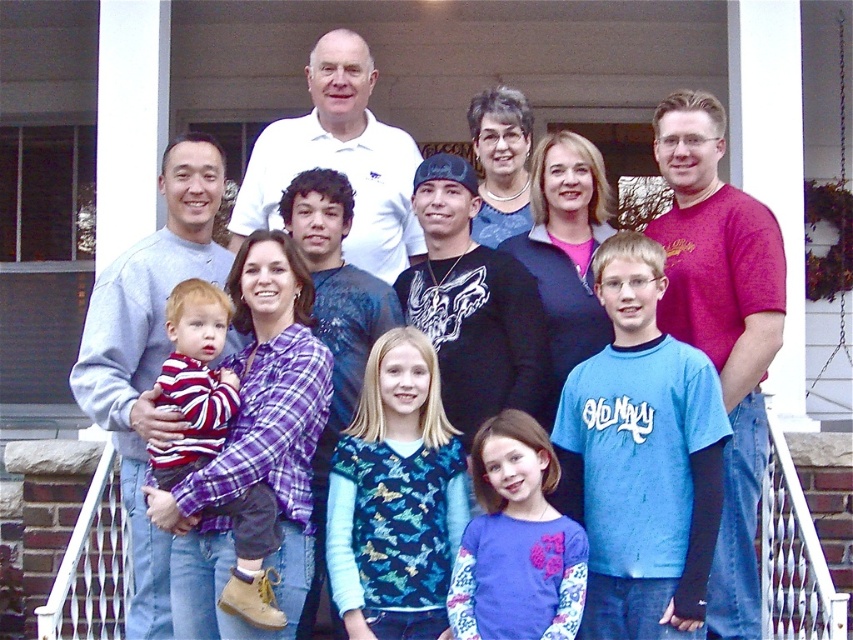
Question: Considering the real-world distances, which object is farthest from the matte red t-shirt at right?

Choices:
 (A) purple fleece shirt at center
 (B) blue printed sweater at center
 (C) white polo shirt at upper center
 (D) blue cotton shirt at center

Answer: (C)

Question: Can you confirm if blue cotton shirt at center is positioned above gray sweater at left?

Choices:
 (A) no
 (B) yes

Answer: (B)

Question: Is matte red t-shirt at right wider than striped cotton shirt at lower left?

Choices:
 (A) no
 (B) yes

Answer: (B)

Question: Which of the following is the closest to the observer?

Choices:
 (A) blue cotton shirt at center
 (B) gray sweater at left
 (C) striped cotton shirt at lower left
 (D) blue printed sweater at center

Answer: (C)

Question: Is matte red t-shirt at right in front of purple fleece shirt at center?

Choices:
 (A) yes
 (B) no

Answer: (B)

Question: Which object is the farthest from the blue cotton shirt at center?

Choices:
 (A) matte red t-shirt at right
 (B) gray sweater at left
 (C) striped cotton shirt at lower left

Answer: (C)